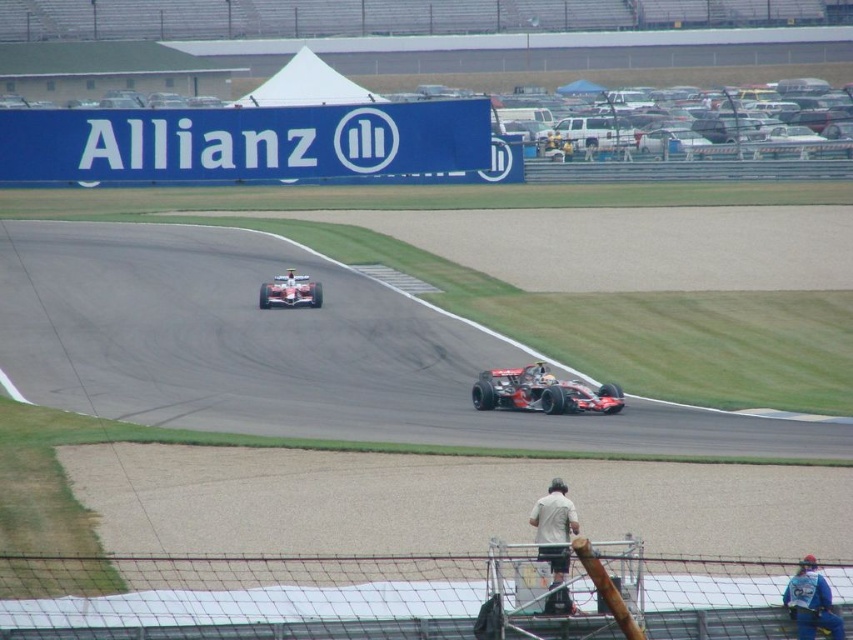
You are a photographer at the Formula One race track. You want to capture a photo of both the shiny silver helmet at center and the white fabric person at center in the same frame. Based on their positions, which object should be positioned to the left in your photo?

The shiny silver helmet at center is to the left of the white fabric person at center, so in your photo, the shiny silver helmet at center should be positioned to the left of the white fabric person at center.

You are a race engineer observing the shiny silver race car at center and the shiny silver helmet at center during a pit stop. Which object is wider?

The shiny silver race car at center is wider than the shiny silver helmet at center.

You are a photographer at the Formula One race track. You need to capture a photo where both the shiny silver helmet at center and the white fabric person at center are visible. Considering their sizes, which object should be placed closer to the camera to ensure both fit in the frame?

The shiny silver helmet at center has a lesser width compared to the white fabric person at center. To ensure both fit in the frame, the white fabric person at center should be placed closer to the camera since it is wider, allowing the smaller helmet to be captured alongside without cropping.